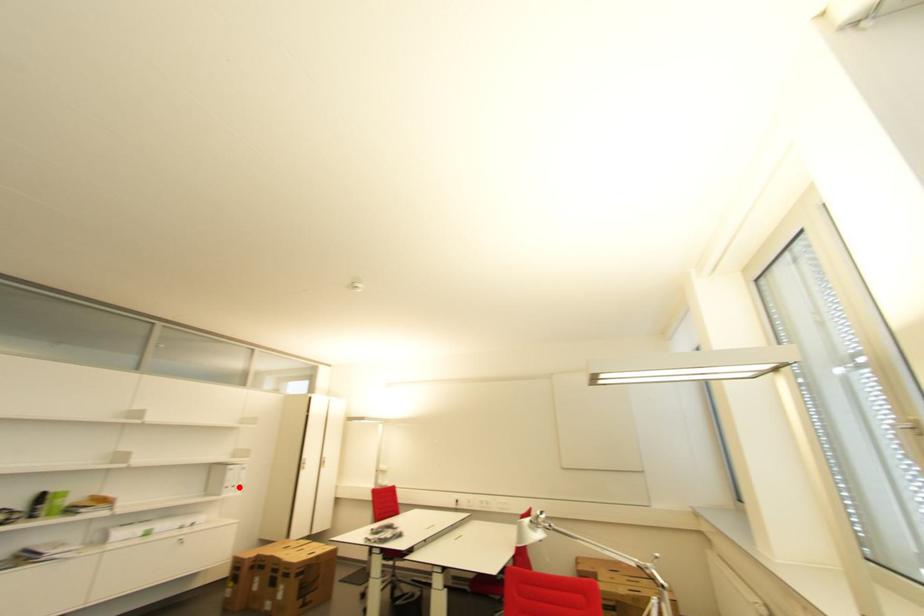
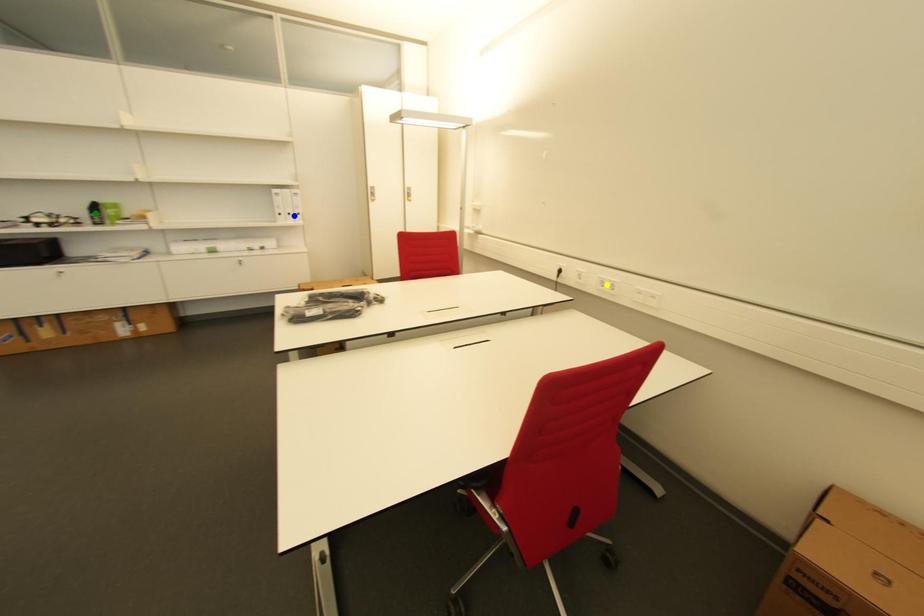
Question: I am providing you with two images of the same scene from different viewpoints. A red point is marked on the first image. You are given multiple points on the second image. Which mark in image 2 goes with the point in image 1?

Choices:
 (A) green point
 (B) blue point
 (C) yellow point

Answer: (B)